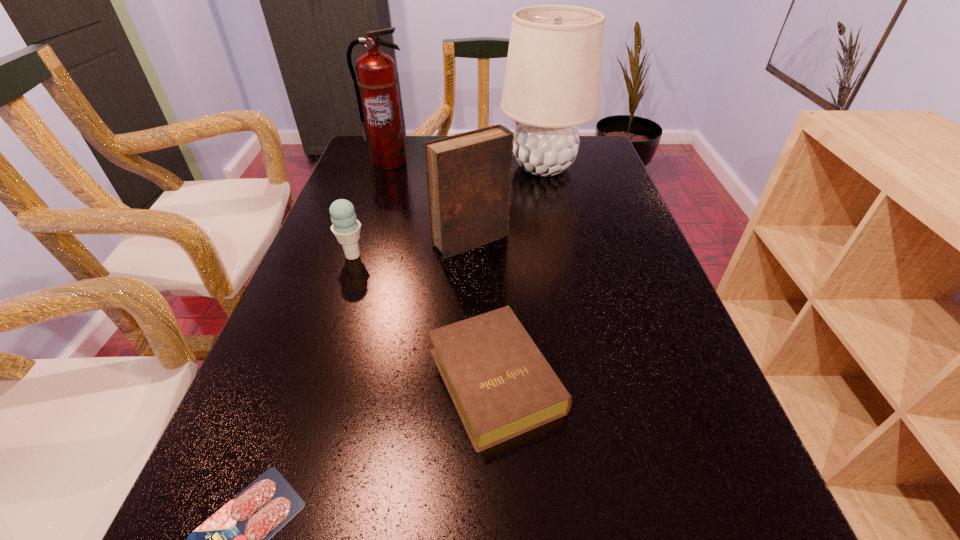
Find the location of a particular element. vacant space at the right edge is located at coordinates (606, 223).

You are a GUI agent. You are given a task and a screenshot of the screen. Output one action in this format:
    pyautogui.click(x=<x>, y=<y>)
    Task: Click on the vacant point at the far left corner
    
    Given the screenshot: What is the action you would take?
    pyautogui.click(x=366, y=148)

The height and width of the screenshot is (540, 960). Find the location of `free region at the far right corner of the desktop`. free region at the far right corner of the desktop is located at coordinates [598, 136].

Where is `vacant space that is in between the second shortest object and the ice cream`? The image size is (960, 540). vacant space that is in between the second shortest object and the ice cream is located at coordinates (424, 318).

Where is `vacant point located between the nearer Bible and the fire extinguisher`? This screenshot has height=540, width=960. vacant point located between the nearer Bible and the fire extinguisher is located at coordinates (442, 271).

Where is `free space between the fourth shortest object and the ice cream`? free space between the fourth shortest object and the ice cream is located at coordinates (412, 248).

At what (x,y) coordinates should I click in order to perform the action: click on object that is the fourth nearest to the fire extinguisher. Please return your answer as a coordinate pair (x, y). The image size is (960, 540). Looking at the image, I should click on (501, 385).

Identify which object is located as the second nearest to the nearest object. Please provide its 2D coordinates. Your answer should be formatted as a tuple, i.e. [(x, y)], where the tuple contains the x and y coordinates of a point satisfying the conditions above.

[(346, 228)]

This screenshot has width=960, height=540. Find the location of `vacant position in the image that satisfies the following two spatial constraints: 1. on the side of the fire extinguisher with the handle and hose; 2. on the right side of the nearer Bible`. vacant position in the image that satisfies the following two spatial constraints: 1. on the side of the fire extinguisher with the handle and hose; 2. on the right side of the nearer Bible is located at coordinates (319, 380).

At what (x,y) coordinates should I click in order to perform the action: click on vacant space that satisfies the following two spatial constraints: 1. on the side of the lampshade with the handle and hose; 2. on the left side of the fire extinguisher. Please return your answer as a coordinate pair (x, y). Looking at the image, I should click on (387, 167).